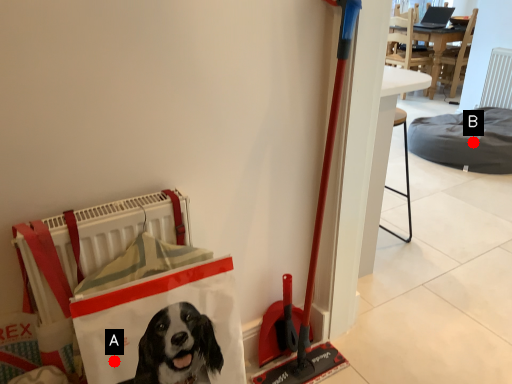
Question: Two points are circled on the image, labeled by A and B beside each circle. Which point is farther from the camera taking this photo?

Choices:
 (A) A is further
 (B) B is further

Answer: (B)